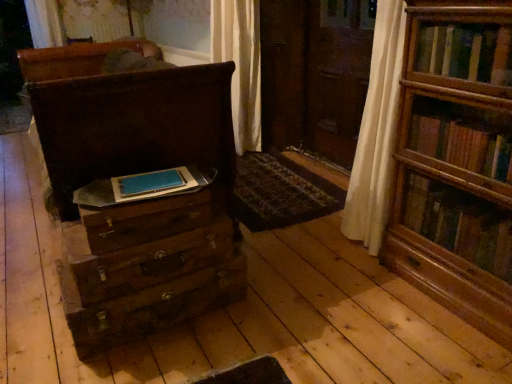
Where is `empty space that is in between wooden bookshelf at right and wooden drawer at center, the 1th drawer in the bottom-to-top sequence`? empty space that is in between wooden bookshelf at right and wooden drawer at center, the 1th drawer in the bottom-to-top sequence is located at coordinates (320, 304).